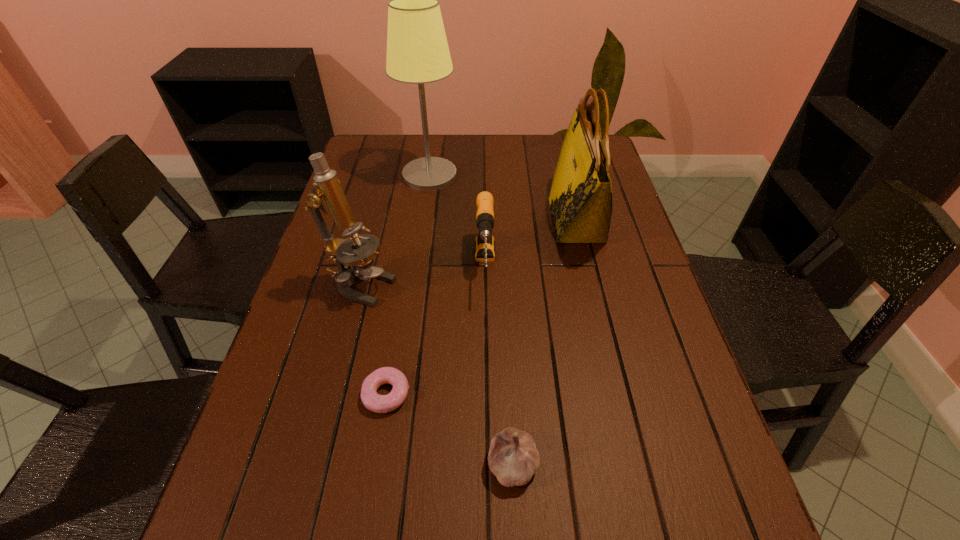
Image resolution: width=960 pixels, height=540 pixels. Identify the location of free space located 0.340m on the front-facing side of the rightmost object. (435, 220).

Locate an element on the screen. vacant space located 0.230m on the front-facing side of the rightmost object is located at coordinates (473, 220).

Identify the location of free space located 0.200m on the back of the microscope. Image resolution: width=960 pixels, height=540 pixels. (378, 220).

What are the coordinates of `vacant area located on the handle side of the drill` in the screenshot? It's located at (487, 419).

The image size is (960, 540). I want to click on free region located on the right of the nearest object, so click(577, 463).

Where is `vacant region located 0.060m on the back of the doughnut`? vacant region located 0.060m on the back of the doughnut is located at coordinates (394, 349).

The width and height of the screenshot is (960, 540). I want to click on object located in the far edge section of the desktop, so click(417, 49).

You are a GUI agent. You are given a task and a screenshot of the screen. Output one action in this format:
    pyautogui.click(x=<x>, y=<y>)
    Task: Click on the object present at the left edge
    This screenshot has height=540, width=960.
    Given the screenshot: What is the action you would take?
    pyautogui.click(x=353, y=261)

Find the location of `object that is at the right edge`. object that is at the right edge is located at coordinates (580, 199).

What are the coordinates of `free region at the far edge of the desktop` in the screenshot? It's located at [x=531, y=157].